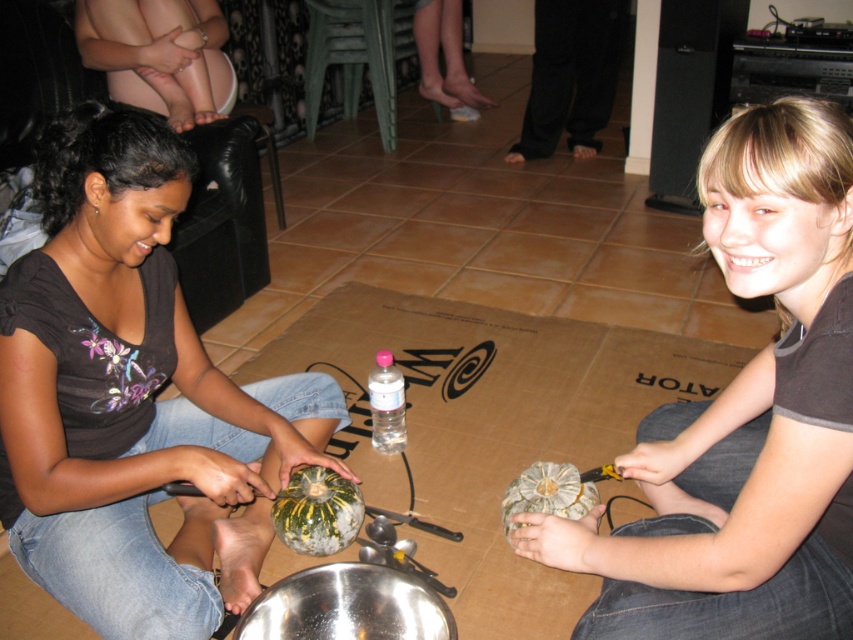
What is the color of the area where the point at coordinates (x=160, y=54) is located?

The area where the point at coordinates (x=160, y=54) is located is smooth skin at upper left.

Based on the photo, you are standing in the living room and see the smooth skin at upper left. If you want to touch it, how many steps would you need to take if each step covers 2.5 feet?

The smooth skin at upper left is 8.68 feet away from the viewer. Since each step covers 2.5 feet, dividing 8.68 by 2.5 gives approximately 3.47 steps. Since you can only take whole steps, you would need to take 4 steps to reach it.

Based on the photo, you are a guest in the room and want to place a decorative item between the green striped squash at center and the green textured gourd at lower center. Can you fit it there?

The green striped squash at center is positioned under the green textured gourd at lower center, so there is no space between them for placing a decorative item.